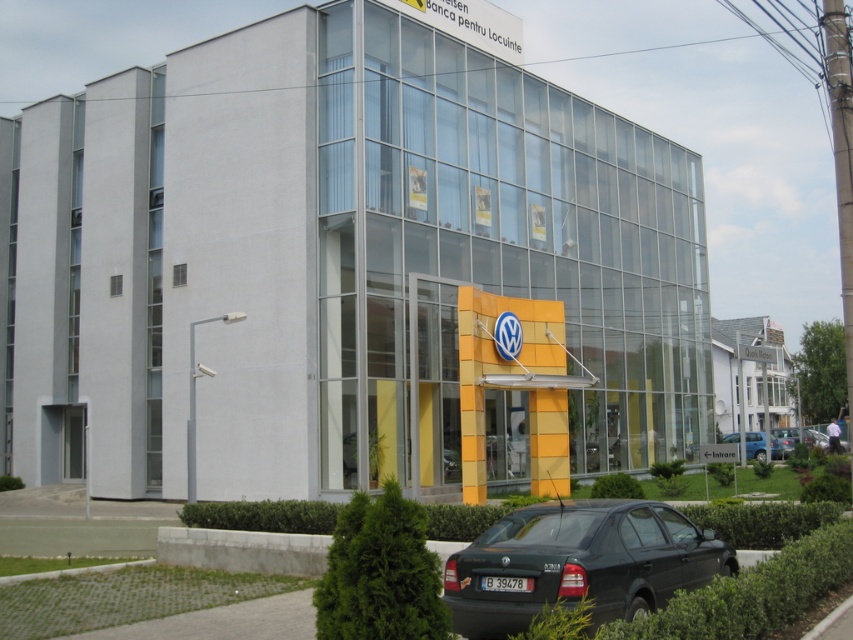
You are standing at the entrance of the modern building and want to reach the point marked at coordinates point [555,504]. If your walking speed is 1.2 meters per second, how many seconds will it take you to reach that point?

The distance between you and point [555,504] is 8.82 meters. At a speed of 1.2 meters per second, dividing the distance by speed gives 8.82 divided by 1.2, which equals approximately 7.35 seconds. So, it will take about 7.35 seconds to reach the point.

You are a visitor arriving at the Volkswagen dealership and want to park your car. The black matte sedan at lower center and the metallic silver sedan at lower right are blocking the entrance. Which car should you move to allow access to the entrance?

The black matte sedan at lower center is in front of the metallic silver sedan at lower right, so you should move the black matte sedan at lower center first to allow access to the entrance.

You are a delivery person trying to park your van in the parking spot next to the blue metallic car at lower right and the metallic silver sedan at lower right. The parking spot is only tall enough to accommodate vehicles up to 1.8 meters in height. Can both vehicles fit in the parking spot?

The blue metallic car at lower right is taller than the metallic silver sedan at lower right. Since the parking spot has a height limit of 1.8 meters, only the metallic silver sedan at lower right can fit, as the blue metallic car at lower right exceeds the height requirement.